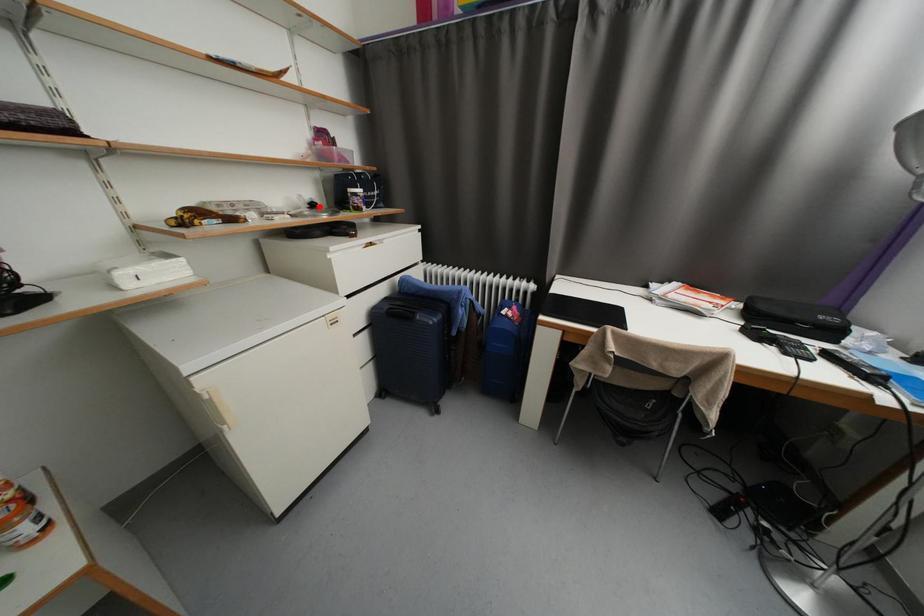
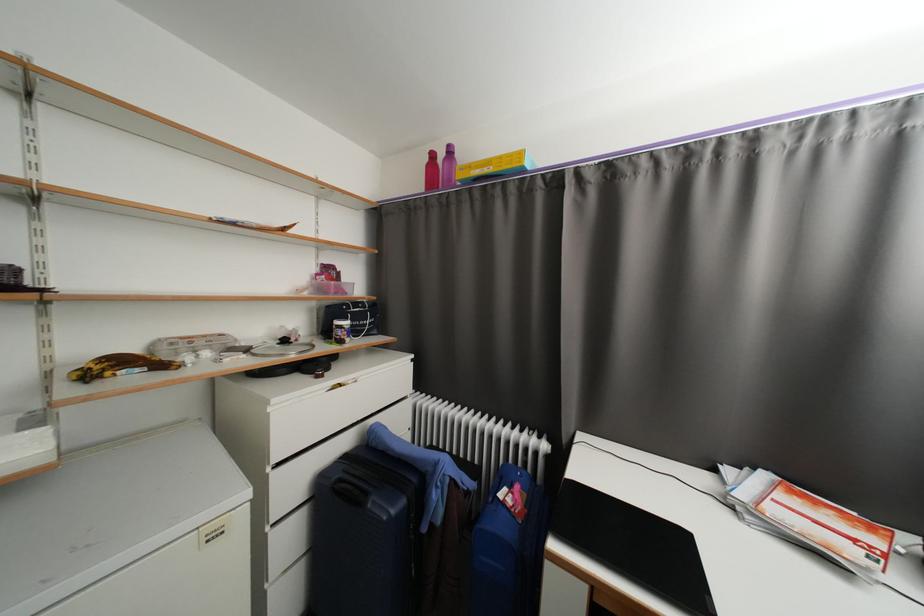
Question: I am providing you with two images of the same scene from different viewpoints. A red point is shown in image1. For the corresponding object point in image2, is it positioned nearer or farther from the camera?

Choices:
 (A) Nearer
 (B) Farther

Answer: (B)